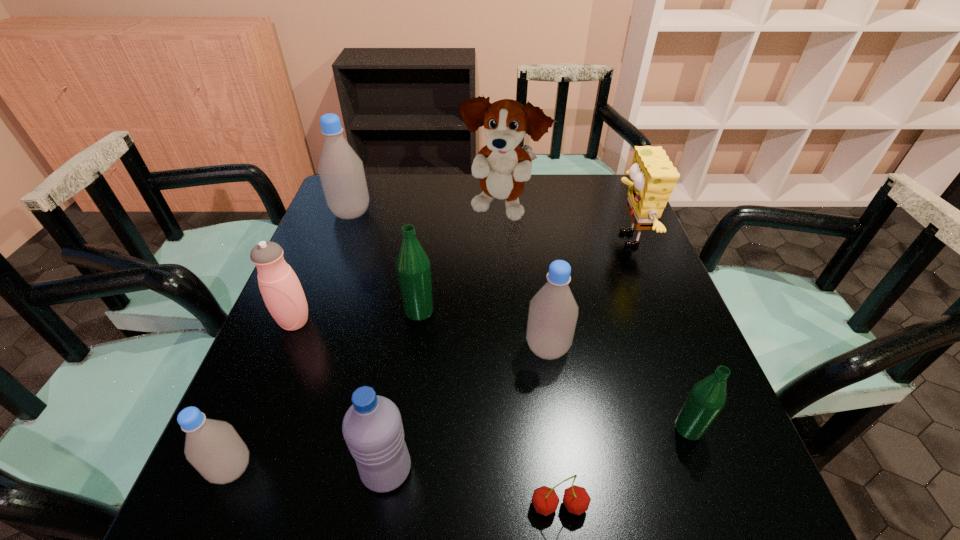
What are the coordinates of `bottle that is at the near edge` in the screenshot? It's located at (213, 447).

Locate an element on the screen. The image size is (960, 540). cherry that is positioned at the near edge is located at coordinates (576, 499).

Locate an element on the screen. The image size is (960, 540). thermos bottle positioned at the left edge is located at coordinates (281, 290).

Where is `sponge that is at the right edge`? This screenshot has width=960, height=540. sponge that is at the right edge is located at coordinates (652, 180).

Where is `bottle located in the right edge section of the desktop`? Image resolution: width=960 pixels, height=540 pixels. bottle located in the right edge section of the desktop is located at coordinates (707, 398).

This screenshot has height=540, width=960. What are the coordinates of `object that is at the far left corner` in the screenshot? It's located at (341, 171).

Find the location of a particular element. This screenshot has height=540, width=960. object that is at the near left corner is located at coordinates (x=213, y=447).

This screenshot has width=960, height=540. Find the location of `object that is positioned at the far right corner`. object that is positioned at the far right corner is located at coordinates (652, 180).

Locate an element on the screen. This screenshot has height=540, width=960. free region at the far edge of the desktop is located at coordinates (560, 214).

Where is `vacant area at the near edge`? The image size is (960, 540). vacant area at the near edge is located at coordinates (635, 528).